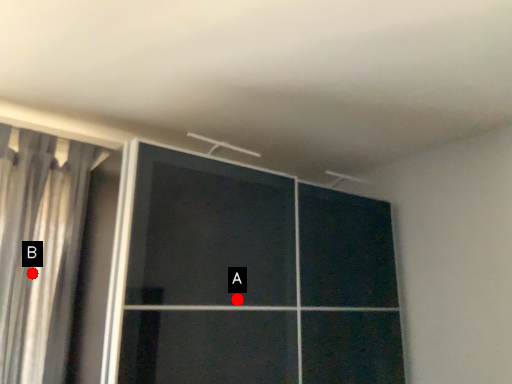
Question: Two points are circled on the image, labeled by A and B beside each circle. Which point is closer to the camera?

Choices:
 (A) A is closer
 (B) B is closer

Answer: (A)